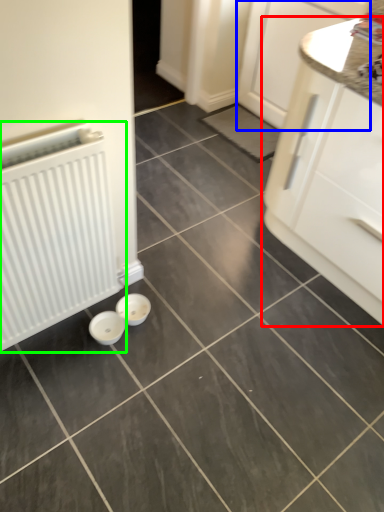
Question: Which object is the closest to the cabinetry (highlighted by a red box)? Choose among these: cabinetry (highlighted by a blue box) or radiator (highlighted by a green box).

Choices:
 (A) cabinetry
 (B) radiator

Answer: (A)